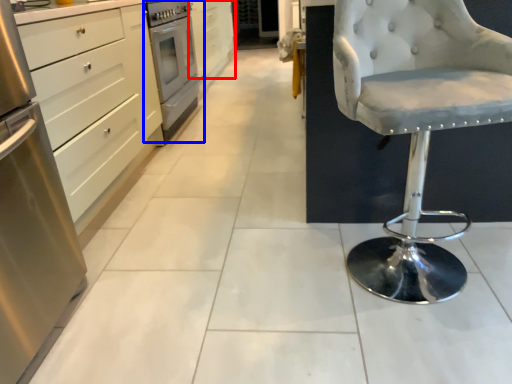
Question: Which object appears closest to the camera in this image, cabinetry (highlighted by a red box) or home appliance (highlighted by a blue box)?

Choices:
 (A) cabinetry
 (B) home appliance

Answer: (B)